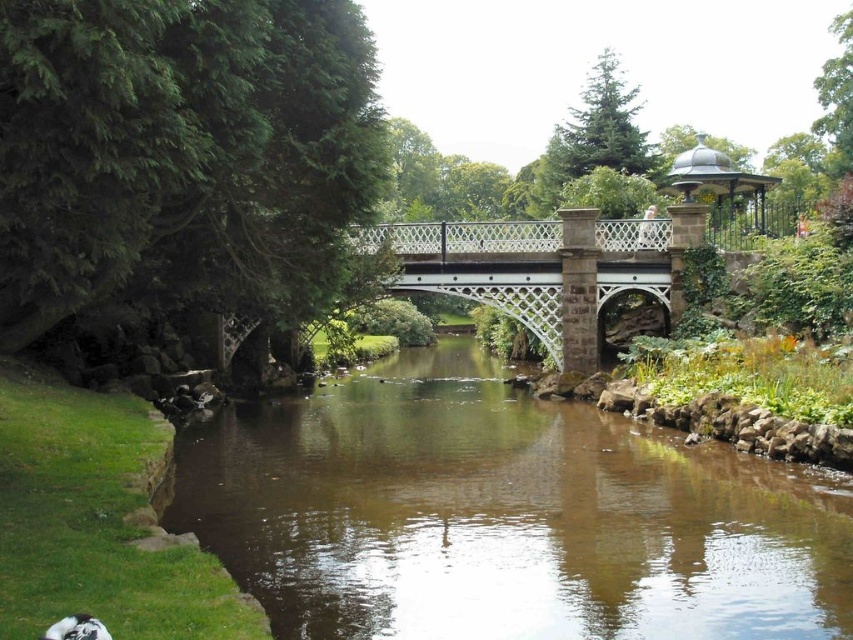
Does white metal bridge at center appear over polished metal gazebo at upper right?

Actually, white metal bridge at center is below polished metal gazebo at upper right.

In the scene shown: Who is lower down, white metal bridge at center or polished metal gazebo at upper right?

Positioned lower is white metal bridge at center.

Between point (566, 312) and point (700, 193), which one is positioned behind?

The point (700, 193) is more distant.

Find the location of a particular element. This screenshot has height=640, width=853. white metal bridge at center is located at coordinates (534, 269).

Who is positioned more to the right, brown smooth water at center or polished metal gazebo at upper right?

polished metal gazebo at upper right is more to the right.

Which is above, brown smooth water at center or polished metal gazebo at upper right?

polished metal gazebo at upper right

This screenshot has height=640, width=853. Find the location of `brown smooth water at center`. brown smooth water at center is located at coordinates pyautogui.click(x=503, y=516).

Does brown smooth water at center have a lesser width compared to white metal bridge at center?

No.

How distant is brown smooth water at center from white metal bridge at center?

They are 64.30 feet apart.

Where is `brown smooth water at center`? brown smooth water at center is located at coordinates (503, 516).